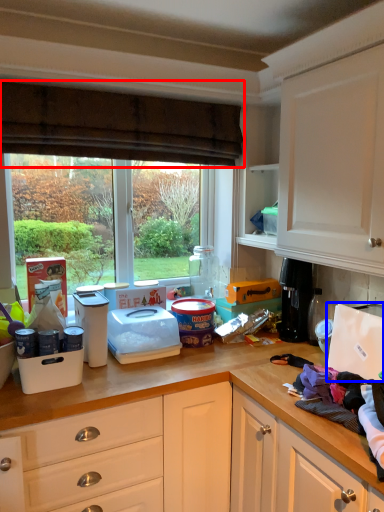
Question: Which object is further to the camera taking this photo, curtain (highlighted by a red box) or appliance (highlighted by a blue box)?

Choices:
 (A) curtain
 (B) appliance

Answer: (A)